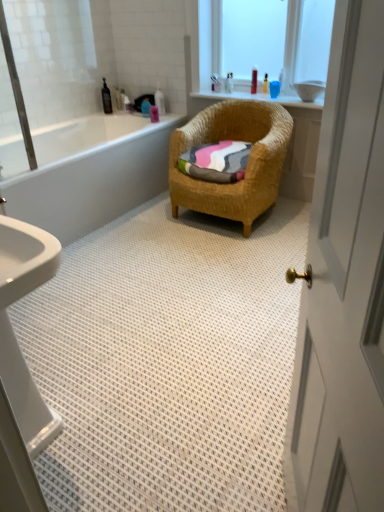
You are a GUI agent. You are given a task and a screenshot of the screen. Output one action in this format:
    pyautogui.click(x=<x>, y=<y>)
    Task: Click on the unoccupied area in front of woven wicker chair at center
    The height and width of the screenshot is (512, 384).
    Given the screenshot: What is the action you would take?
    pyautogui.click(x=211, y=263)